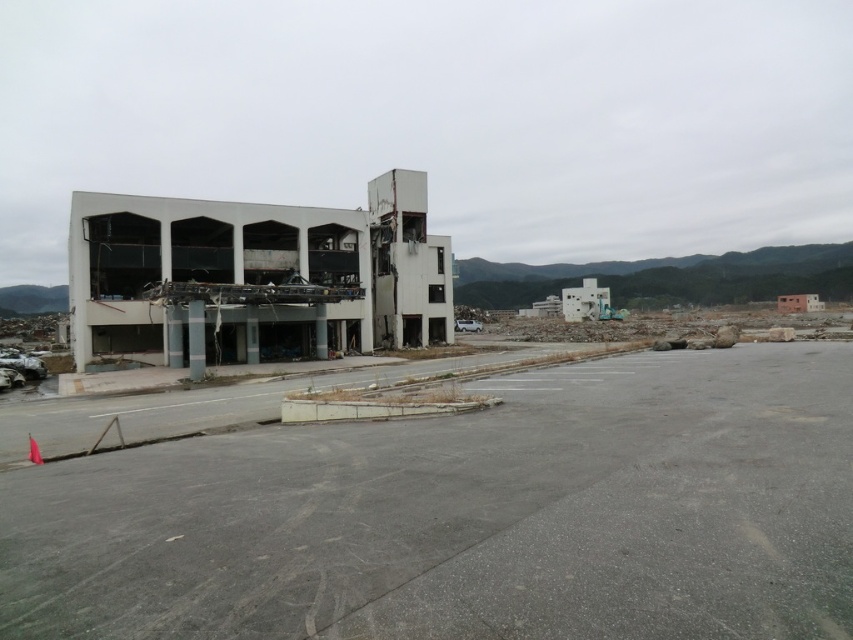
Is white concrete building at left positioned at the back of white concrete building at center?

No, it is in front of white concrete building at center.

Between point (103, 637) and point (74, 284), which one is positioned in front?

Point (103, 637) is in front.

This screenshot has height=640, width=853. Identify the location of white concrete building at left. (469, 516).